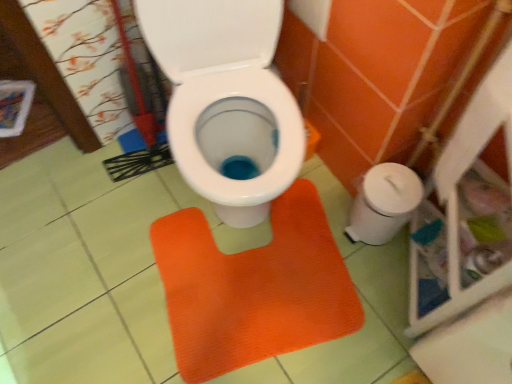
In order to face orange fabric mat at center, should I rotate leftwards or rightwards?

You should look right and rotate roughly 0.557 degrees.

The height and width of the screenshot is (384, 512). I want to click on orange fabric mat at center, so click(x=253, y=288).

Describe the element at coordinates (253, 288) in the screenshot. I see `orange fabric mat at center` at that location.

In order to click on orange fabric mat at center in this screenshot , I will do `click(253, 288)`.